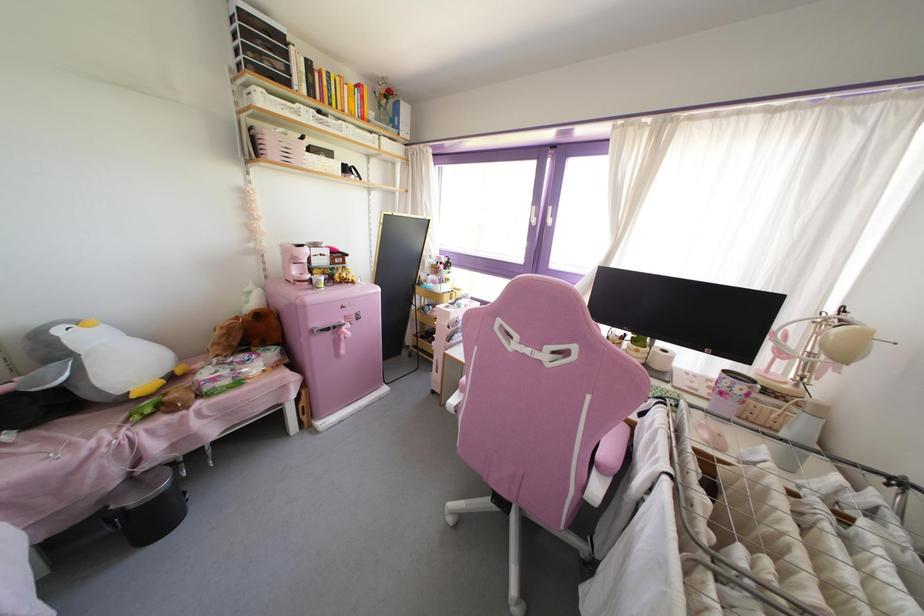
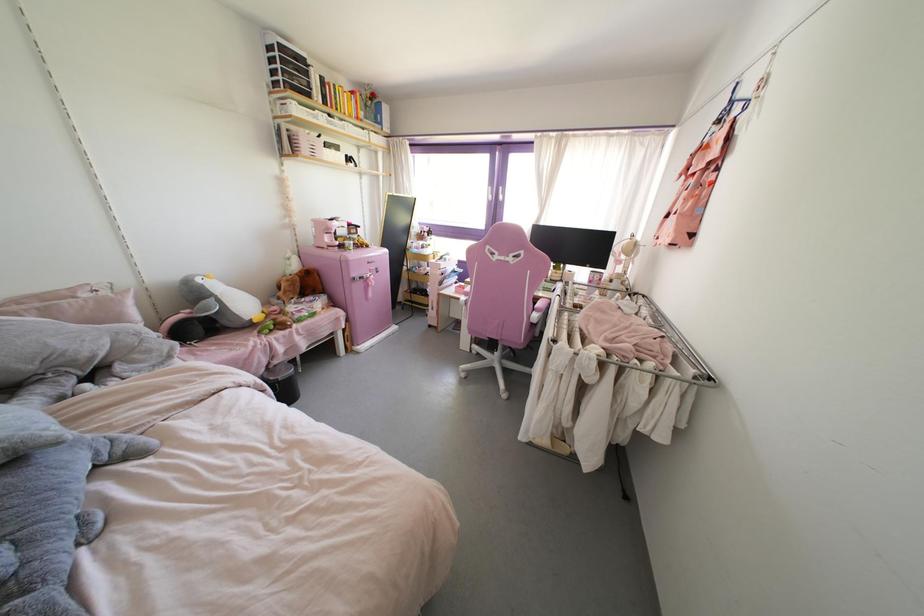
The point at (x=596, y=488) is marked in the first image. Where is the corresponding point in the second image?

(535, 315)